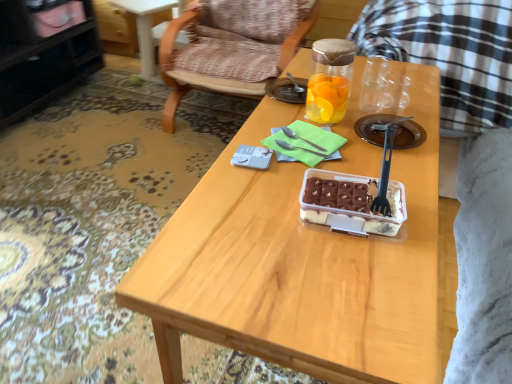
Question: Are black glossy cabinet at upper left and black plastic fork at center, which is the first fork in front-to-back order, beside each other?

Choices:
 (A) yes
 (B) no

Answer: (B)

Question: From the image's perspective, is black glossy cabinet at upper left located above black plastic fork at center, the 3th fork when ordered from back to front?

Choices:
 (A) no
 (B) yes

Answer: (B)

Question: Is the depth of black glossy cabinet at upper left less than that of black plastic fork at center, which is the first fork in front-to-back order?

Choices:
 (A) yes
 (B) no

Answer: (B)

Question: Is black glossy cabinet at upper left positioned behind black plastic fork at center, the 3th fork when ordered from back to front?

Choices:
 (A) no
 (B) yes

Answer: (B)

Question: From a real-world perspective, is black glossy cabinet at upper left located higher than black plastic fork at center, which is the first fork in front-to-back order?

Choices:
 (A) yes
 (B) no

Answer: (B)

Question: From their relative heights in the image, would you say black plastic fork at center, which is the first fork in front-to-back order, is taller or shorter than wooden armchair at center?

Choices:
 (A) short
 (B) tall

Answer: (A)

Question: From a real-world perspective, is black plastic fork at center, the 3th fork when ordered from back to front, above or below wooden armchair at center?

Choices:
 (A) below
 (B) above

Answer: (B)

Question: In terms of width, does black plastic fork at center, the 3th fork when ordered from back to front, look wider or thinner when compared to wooden armchair at center?

Choices:
 (A) thin
 (B) wide

Answer: (A)

Question: Does point (384, 187) appear closer or farther from the camera than point (186, 82)?

Choices:
 (A) closer
 (B) farther

Answer: (A)

Question: From the image's perspective, relative to satin silver fork at center, arranged as the 3th fork when viewed from the front, is transparent glass jar at center above or below?

Choices:
 (A) below
 (B) above

Answer: (B)

Question: Considering the positions of point (348, 46) and point (291, 130), is point (348, 46) closer or farther from the camera than point (291, 130)?

Choices:
 (A) closer
 (B) farther

Answer: (A)

Question: Is transparent glass jar at center taller or shorter than satin silver fork at center, which appears as the first fork when viewed from the back?

Choices:
 (A) short
 (B) tall

Answer: (B)

Question: Considering the relative positions of transparent glass jar at center and satin silver fork at center, which appears as the first fork when viewed from the back, in the image provided, is transparent glass jar at center to the left or to the right of satin silver fork at center, which appears as the first fork when viewed from the back,?

Choices:
 (A) left
 (B) right

Answer: (B)

Question: Considering their positions, is transparent glass jar at center located in front of or behind black glossy cabinet at upper left?

Choices:
 (A) behind
 (B) front

Answer: (B)

Question: From the image's perspective, is transparent glass jar at center located above or below black glossy cabinet at upper left?

Choices:
 (A) below
 (B) above

Answer: (A)